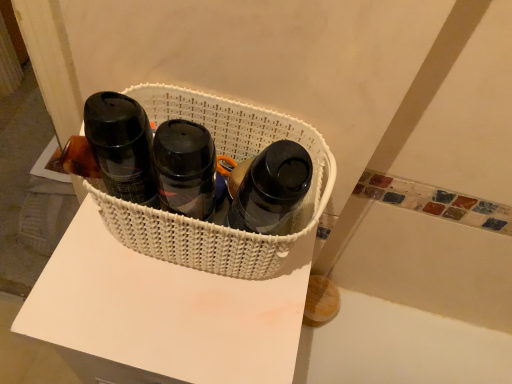
Identify the location of free spot to the right of matte black thermos at left, marked as the 1th bottle in a left-to-right arrangement. The image size is (512, 384). (236, 312).